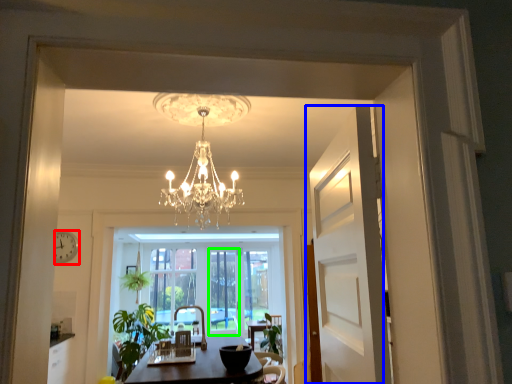
Question: Which object is positioned closest to clock (highlighted by a red box)? Select from door (highlighted by a blue box) and window screen (highlighted by a green box).

Choices:
 (A) door
 (B) window screen

Answer: (B)